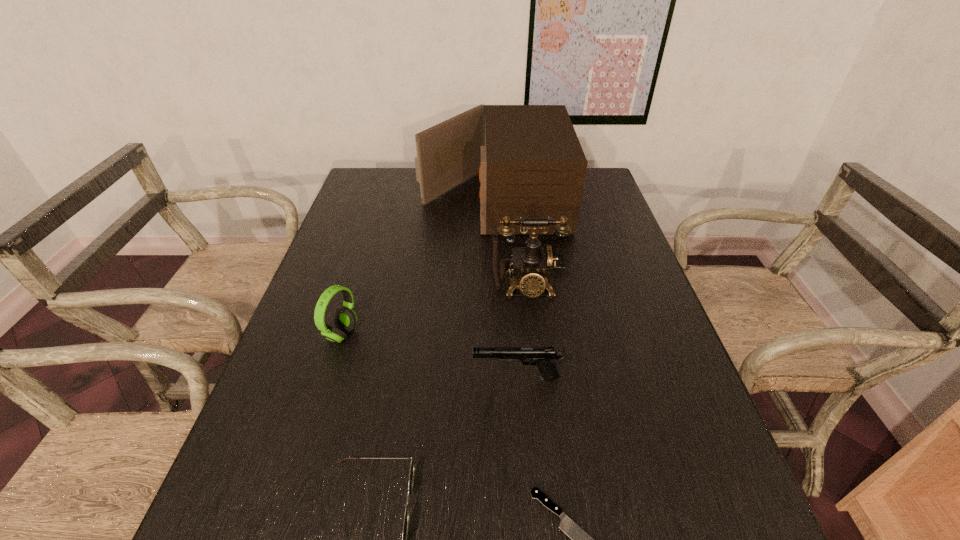
The width and height of the screenshot is (960, 540). I want to click on microwave oven, so click(531, 164).

Identify the location of the second farthest object. This screenshot has height=540, width=960. (532, 263).

Image resolution: width=960 pixels, height=540 pixels. Identify the location of the third farthest object. (345, 319).

Find the location of a particular element. This screenshot has height=540, width=960. headset is located at coordinates (345, 319).

The width and height of the screenshot is (960, 540). What are the coordinates of `the fourth farthest object` in the screenshot? It's located at (544, 357).

Where is `the third shortest object`? The image size is (960, 540). the third shortest object is located at coordinates (544, 357).

This screenshot has height=540, width=960. Identify the location of vacant space located with the door open on the front of the farthest object. (372, 199).

The width and height of the screenshot is (960, 540). I want to click on free space located with the door open on the front of the farthest object, so click(x=364, y=199).

Image resolution: width=960 pixels, height=540 pixels. In order to click on free location located with the door open on the front of the farthest object in this screenshot , I will do [370, 199].

The height and width of the screenshot is (540, 960). I want to click on vacant region located 0.380m on the rotary dial of the second farthest object, so click(545, 448).